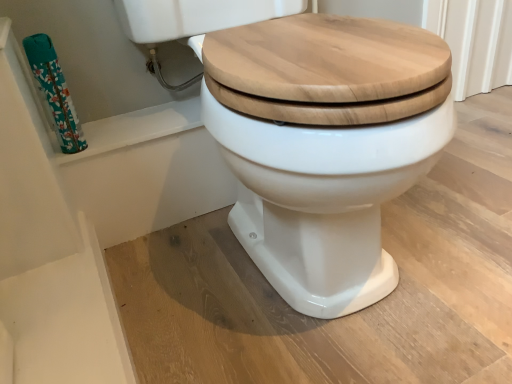
Where is `white glossy toilet at center`? The image size is (512, 384). white glossy toilet at center is located at coordinates (325, 145).

The height and width of the screenshot is (384, 512). What do you see at coordinates (325, 145) in the screenshot? I see `white glossy toilet at center` at bounding box center [325, 145].

This screenshot has width=512, height=384. What do you see at coordinates (54, 92) in the screenshot?
I see `teal floral-patterned toilet paper at left` at bounding box center [54, 92].

Locate an element on the screen. The width and height of the screenshot is (512, 384). teal floral-patterned toilet paper at left is located at coordinates (54, 92).

You are a GUI agent. You are given a task and a screenshot of the screen. Output one action in this format:
    pyautogui.click(x=<x>, y=<y>)
    Task: Click on the white glossy toilet at center
    This screenshot has height=384, width=512.
    Given the screenshot: What is the action you would take?
    pyautogui.click(x=325, y=145)

Which is more to the left, white glossy toilet at center or teal floral-patterned toilet paper at left?

From the viewer's perspective, teal floral-patterned toilet paper at left appears more on the left side.

Which is in front, white glossy toilet at center or teal floral-patterned toilet paper at left?

white glossy toilet at center is closer to the camera.

Which is closer, (362, 127) or (52, 91)?

Point (362, 127) appears to be closer to the viewer than point (52, 91).

From the image's perspective, between white glossy toilet at center and teal floral-patterned toilet paper at left, who is located below?

From the image's view, white glossy toilet at center is below.

From a real-world perspective, is white glossy toilet at center physically located above or below teal floral-patterned toilet paper at left?

From a real-world perspective, white glossy toilet at center is physically below teal floral-patterned toilet paper at left.

Considering the relative sizes of white glossy toilet at center and teal floral-patterned toilet paper at left in the image provided, is white glossy toilet at center thinner than teal floral-patterned toilet paper at left?

Incorrect, the width of white glossy toilet at center is not less than that of teal floral-patterned toilet paper at left.

Which of these two, white glossy toilet at center or teal floral-patterned toilet paper at left, stands shorter?

With less height is teal floral-patterned toilet paper at left.

Considering the relative sizes of white glossy toilet at center and teal floral-patterned toilet paper at left in the image provided, is white glossy toilet at center bigger than teal floral-patterned toilet paper at left?

Indeed, white glossy toilet at center has a larger size compared to teal floral-patterned toilet paper at left.

Consider the image. Is white glossy toilet at center outside of teal floral-patterned toilet paper at left?

Yes, white glossy toilet at center is outside of teal floral-patterned toilet paper at left.

Is white glossy toilet at center placed right next to teal floral-patterned toilet paper at left?

No, white glossy toilet at center is not in contact with teal floral-patterned toilet paper at left.

Is teal floral-patterned toilet paper at left at the back of white glossy toilet at center?

No.

How many degrees apart are the facing directions of white glossy toilet at center and teal floral-patterned toilet paper at left?

The angle between the facing direction of white glossy toilet at center and the facing direction of teal floral-patterned toilet paper at left is 0.00513 degrees.

Locate an element on the screen. The image size is (512, 384). toilet paper behind the white glossy toilet at center is located at coordinates (54, 92).

Consider the image. Which object is positioned more to the left, teal floral-patterned toilet paper at left or white glossy toilet at center?

teal floral-patterned toilet paper at left is more to the left.

Is teal floral-patterned toilet paper at left positioned in front of white glossy toilet at center?

That is False.

Is point (56, 123) positioned before point (298, 232)?

No, it is behind (298, 232).

From the image's perspective, which is above, teal floral-patterned toilet paper at left or white glossy toilet at center?

From the image's view, teal floral-patterned toilet paper at left is above.

From a real-world perspective, is teal floral-patterned toilet paper at left under white glossy toilet at center?

No, from a real-world perspective, teal floral-patterned toilet paper at left is not below white glossy toilet at center.

Which object is wider, teal floral-patterned toilet paper at left or white glossy toilet at center?

Wider between the two is white glossy toilet at center.

From the picture: From their relative heights in the image, would you say teal floral-patterned toilet paper at left is taller or shorter than white glossy toilet at center?

teal floral-patterned toilet paper at left is shorter than white glossy toilet at center.

In the scene shown: Does teal floral-patterned toilet paper at left have a smaller size compared to white glossy toilet at center?

Yes, teal floral-patterned toilet paper at left is smaller than white glossy toilet at center.

Is teal floral-patterned toilet paper at left inside the boundaries of white glossy toilet at center, or outside?

teal floral-patterned toilet paper at left lies outside white glossy toilet at center.

Is teal floral-patterned toilet paper at left far away from white glossy toilet at center?

They are positioned close to each other.

Is white glossy toilet at center at the back of teal floral-patterned toilet paper at left?

No.

What's the angular difference between teal floral-patterned toilet paper at left and white glossy toilet at center's facing directions?

They differ by 0.00513 degrees in their facing directions.

The image size is (512, 384). What are the coordinates of `toilet on the right of teal floral-patterned toilet paper at left` in the screenshot? It's located at (325, 145).

Image resolution: width=512 pixels, height=384 pixels. Find the location of `toilet paper lying behind the white glossy toilet at center`. toilet paper lying behind the white glossy toilet at center is located at coordinates (54, 92).

Image resolution: width=512 pixels, height=384 pixels. In the image, there is a teal floral-patterned toilet paper at left. Find the location of `toilet below it (from a real-world perspective)`. toilet below it (from a real-world perspective) is located at coordinates (325, 145).